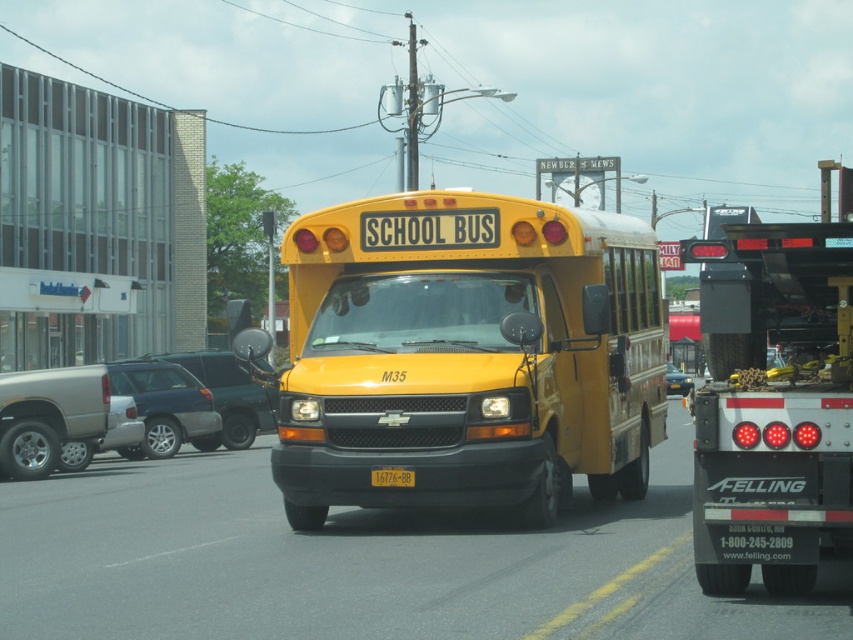
Between yellow matte license plate at center and metallic blue sedan at center, which one appears on the left side from the viewer's perspective?

Positioned to the left is yellow matte license plate at center.

Is point (386, 481) closer to viewer compared to point (677, 376)?

Yes, point (386, 481) is closer to viewer.

Where is `yellow matte license plate at center`? Image resolution: width=853 pixels, height=640 pixels. yellow matte license plate at center is located at coordinates (392, 476).

Who is taller, yellow matte school bus at center or yellow matte license plate at center?

With more height is yellow matte school bus at center.

Between yellow matte school bus at center and yellow matte license plate at center, which one is positioned higher?

yellow matte school bus at center is above.

Does point (364, 211) come farther from viewer compared to point (375, 472)?

Yes, point (364, 211) is farther from viewer.

The height and width of the screenshot is (640, 853). Find the location of `yellow matte school bus at center`. yellow matte school bus at center is located at coordinates (468, 355).

Can you confirm if satin black sedan at center is taller than metallic gray suv at center-left?

Incorrect, satin black sedan at center's height is not larger of metallic gray suv at center-left's.

Is point (161, 436) more distant than point (254, 410)?

No, (161, 436) is in front of (254, 410).

Image resolution: width=853 pixels, height=640 pixels. Describe the element at coordinates (167, 404) in the screenshot. I see `satin black sedan at center` at that location.

What are the coordinates of `satin black sedan at center` in the screenshot? It's located at (167, 404).